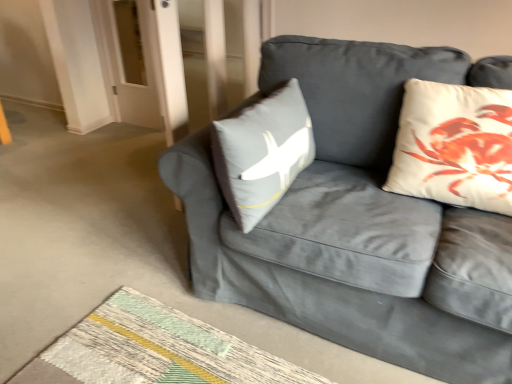
Question: Can you confirm if velvet gray couch at center is thinner than textured woven mat at lower center?

Choices:
 (A) no
 (B) yes

Answer: (A)

Question: From the image's perspective, is velvet gray couch at center under textured woven mat at lower center?

Choices:
 (A) no
 (B) yes

Answer: (A)

Question: From a real-world perspective, is velvet gray couch at center positioned over textured woven mat at lower center based on gravity?

Choices:
 (A) yes
 (B) no

Answer: (A)

Question: Can we say velvet gray couch at center lies outside textured woven mat at lower center?

Choices:
 (A) yes
 (B) no

Answer: (A)

Question: From the image's perspective, is velvet gray couch at center located above textured woven mat at lower center?

Choices:
 (A) no
 (B) yes

Answer: (B)

Question: Considering the positions of velvet gray couch at center and white cotton cushion at upper right in the image, is velvet gray couch at center bigger or smaller than white cotton cushion at upper right?

Choices:
 (A) small
 (B) big

Answer: (B)

Question: From a real-world perspective, is velvet gray couch at center physically located above or below white cotton cushion at upper right?

Choices:
 (A) below
 (B) above

Answer: (A)

Question: Visually, is velvet gray couch at center positioned to the left or to the right of white cotton cushion at upper right?

Choices:
 (A) right
 (B) left

Answer: (B)

Question: Looking at their shapes, would you say velvet gray couch at center is wider or thinner than white cotton cushion at upper right?

Choices:
 (A) wide
 (B) thin

Answer: (A)

Question: Is textured woven mat at lower center taller or shorter than white cotton cushion at upper right?

Choices:
 (A) tall
 (B) short

Answer: (B)

Question: Is point (170, 354) positioned closer to the camera than point (445, 187)?

Choices:
 (A) farther
 (B) closer

Answer: (A)

Question: Based on their sizes in the image, would you say textured woven mat at lower center is bigger or smaller than white cotton cushion at upper right?

Choices:
 (A) small
 (B) big

Answer: (A)

Question: In the image, is textured woven mat at lower center positioned in front of or behind white cotton cushion at upper right?

Choices:
 (A) behind
 (B) front

Answer: (B)

Question: From the image's perspective, relative to velvet gray couch at center, is textured woven mat at lower center above or below?

Choices:
 (A) below
 (B) above

Answer: (A)

Question: Does point (216, 354) appear closer or farther from the camera than point (174, 162)?

Choices:
 (A) closer
 (B) farther

Answer: (B)